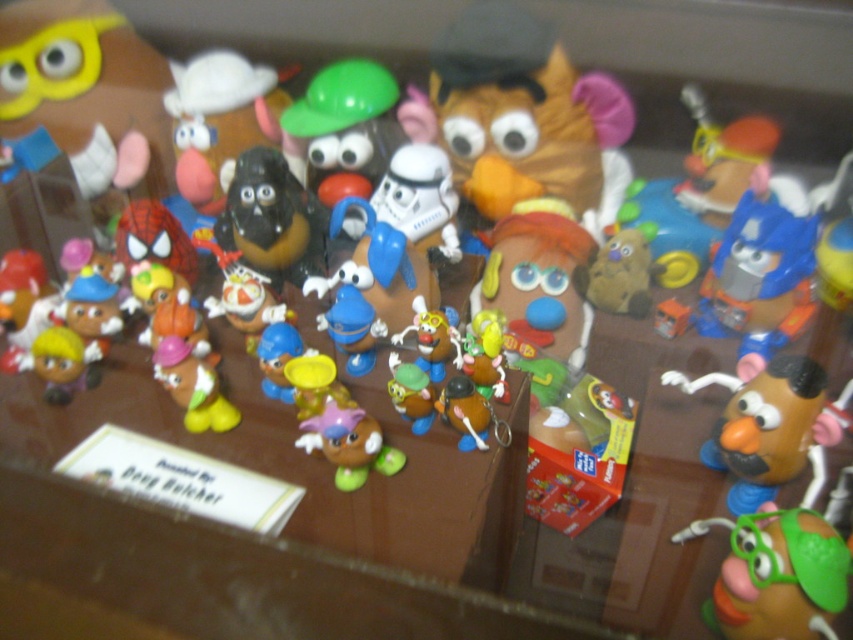
You are standing at the center of the wooden surface where the Mr. Potato Head figurines are displayed. You want to move from the point at coordinates point (503, 288) to point (294, 112). Which direction should you move in to reach the second point?

To move from point (503, 288) to point (294, 112), you should move diagonally towards the northwest direction since point (294, 112) is located to the northwest of point (503, 288).

You are standing in front of a display of Mr. Potato Head figurines arranged on a wooden surface. You notice two points marked as point 1 at coordinates [527,163] and point 2 at [520,288]. Which point is closer to you?

Point 1 at coordinates [527,163] is closer to you because it is further to the viewer than point 2 at [520,288].

You are a toy organizer who needs to place the matte brown bear at center and the blue matte toy at center into a box. The box can only fit items that are narrower than 20 cm. Based on their widths, can both toys fit into the box?

The matte brown bear at center is wider than the blue matte toy at center. However, since the box requires both items to be narrower than 20 cm, we need to know the exact width of the wider toy. If the matte brown bear at center is under 20 cm, both can fit. If not, only the blue matte toy at center might fit if it is under 20 cm. Without specific measurements, we can only compare their widths but cannot confirm if both meet the box requirement.